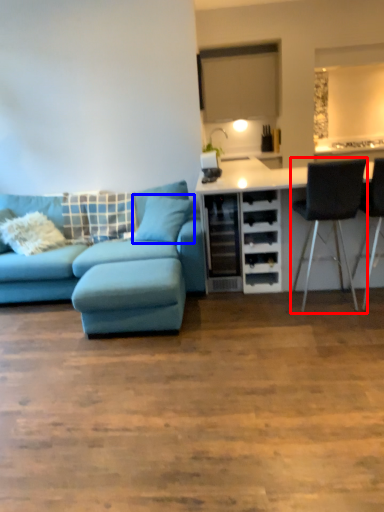
Question: Among these objects, which one is farthest to the camera, chair (highlighted by a red box) or pillow (highlighted by a blue box)?

Choices:
 (A) chair
 (B) pillow

Answer: (B)